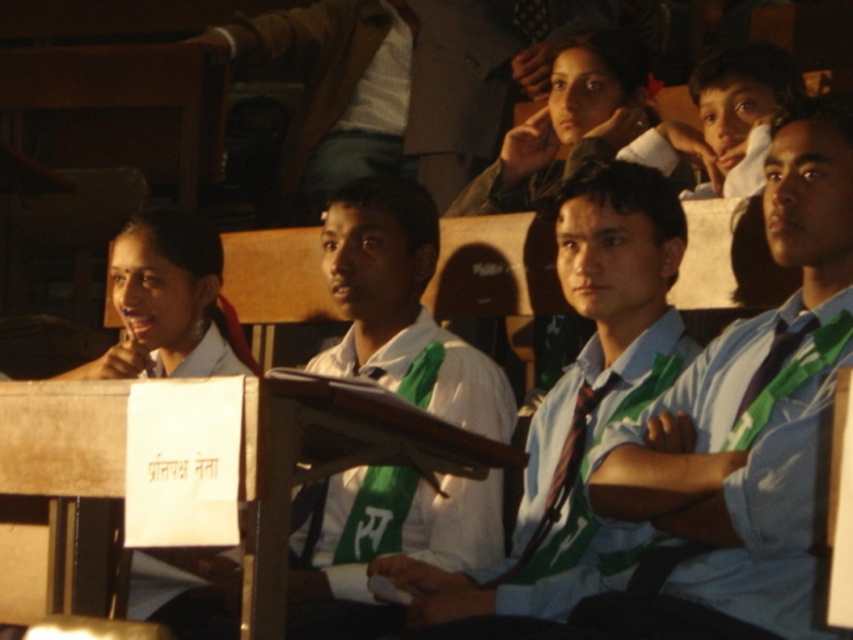
Consider the image. Between white shirt with green tie at center and brown textured coat at upper center, which one appears on the right side from the viewer's perspective?

Positioned to the right is white shirt with green tie at center.

Can you confirm if white shirt with green tie at center is positioned to the left of brown textured coat at upper center?

Incorrect, white shirt with green tie at center is not on the left side of brown textured coat at upper center.

Which is in front, point (596, 337) or point (421, 52)?

Point (596, 337)

Find the location of a particular element. white shirt with green tie at center is located at coordinates (577, 394).

Who is positioned more to the right, light blue shirt at center or white shirt with green tie at center?

light blue shirt at center is more to the right.

This screenshot has width=853, height=640. I want to click on light blue shirt at center, so click(755, 401).

Between light blue shirt at center and brown textured coat at upper center, which one is positioned lower?

light blue shirt at center is below.

Is point (709, 385) behind point (384, 115)?

No.

Where is `light blue shirt at center`? This screenshot has height=640, width=853. light blue shirt at center is located at coordinates (755, 401).